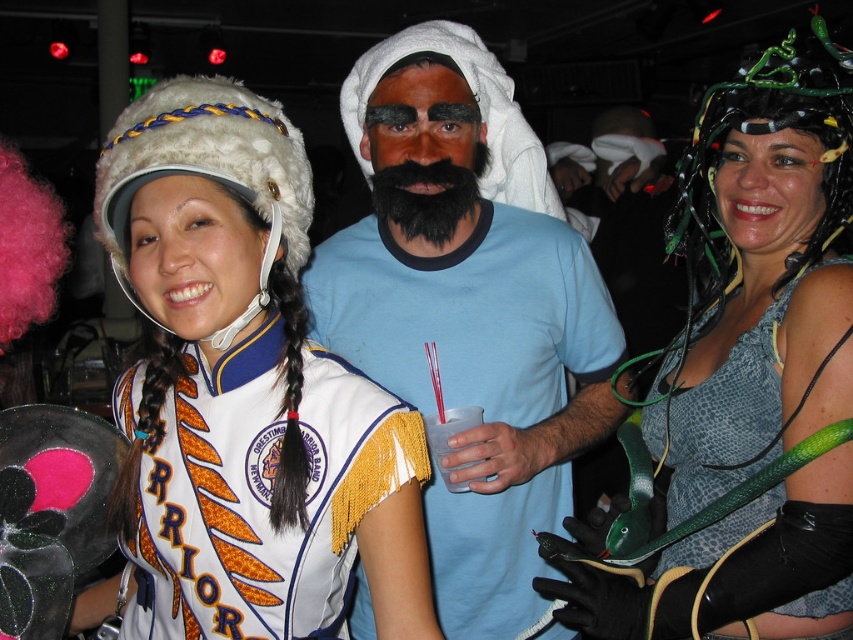
You are standing at the center of the room and want to move towards the Warrior costume. There are two points marked in the image, point A at coordinates point (398, 80) and point B at coordinates point (456, 484). Which point should you move towards to reach the Warrior costume first?

Point B at coordinates point (456, 484) is closer to the Warrior costume because it is in front of point A at coordinates point (398, 80).

You are at the costume party and want to take a photo of both the blue cotton shirt at center and the leather snakeskin dress at center. Which one should you focus on first to ensure it is in the frame?

You should focus on the blue cotton shirt at center first because it is above the leather snakeskin dress at center, so it will be visible first in the frame.

You are at a costume party and want to take a photo with the blue cotton shirt at center and the leather snakeskin dress at center. If your camera has a 30 cm focal range, will you be able to fit both items in the frame?

The blue cotton shirt at center is 29.46 centimeters away from the leather snakeskin dress at center. Since the distance between them is less than the camera focal range of 30 cm, both items can be captured in the frame.